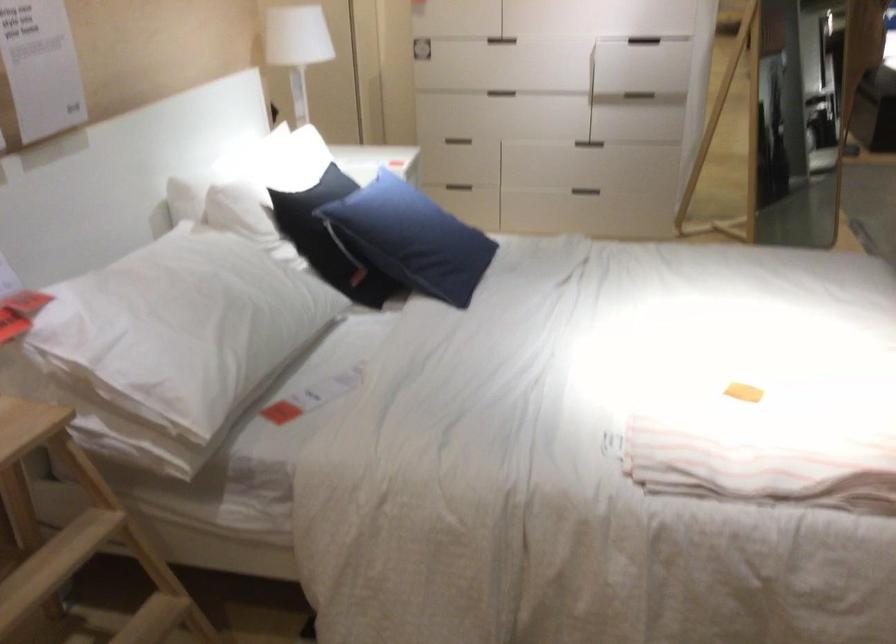
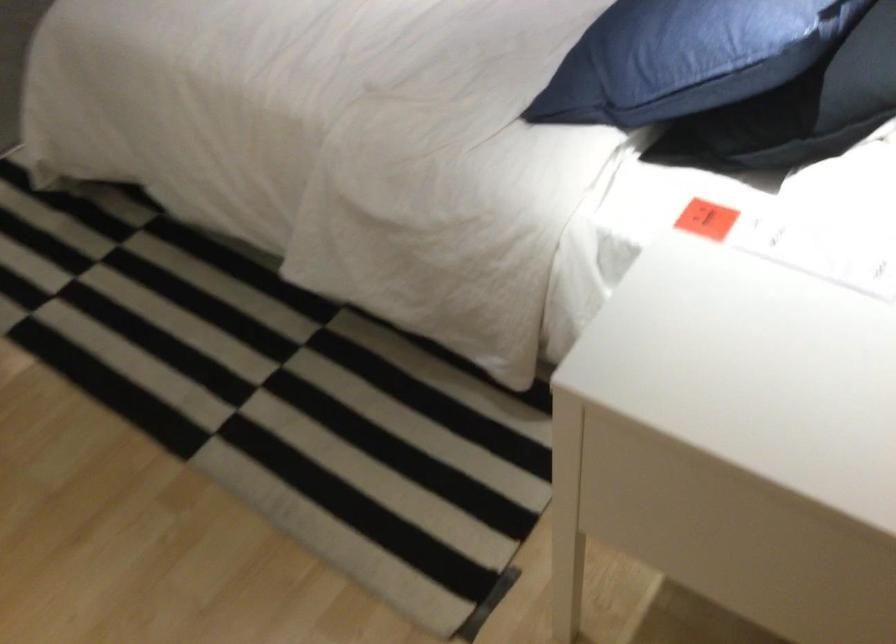
Find the pixel in the second image that matches pixel 435 205 in the first image.

(675, 58)